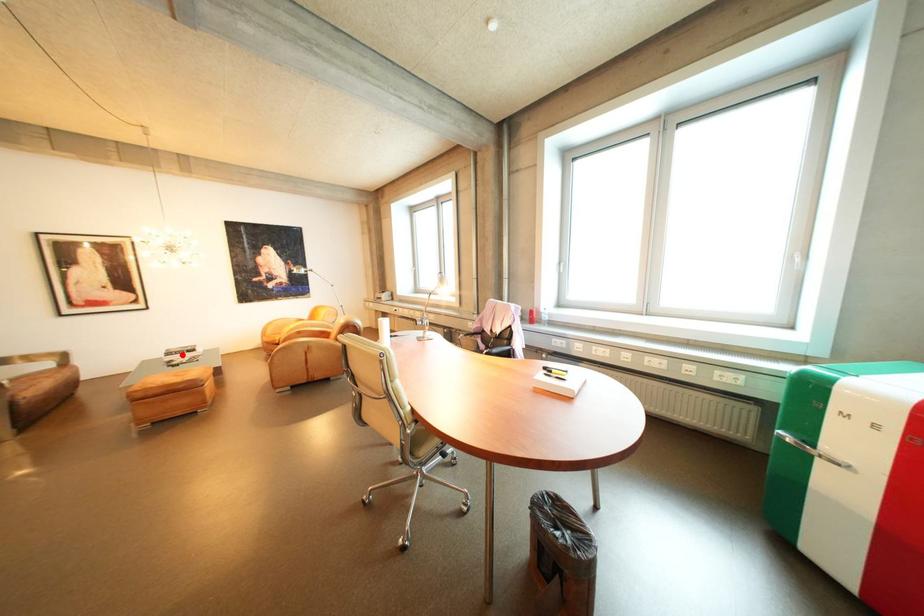
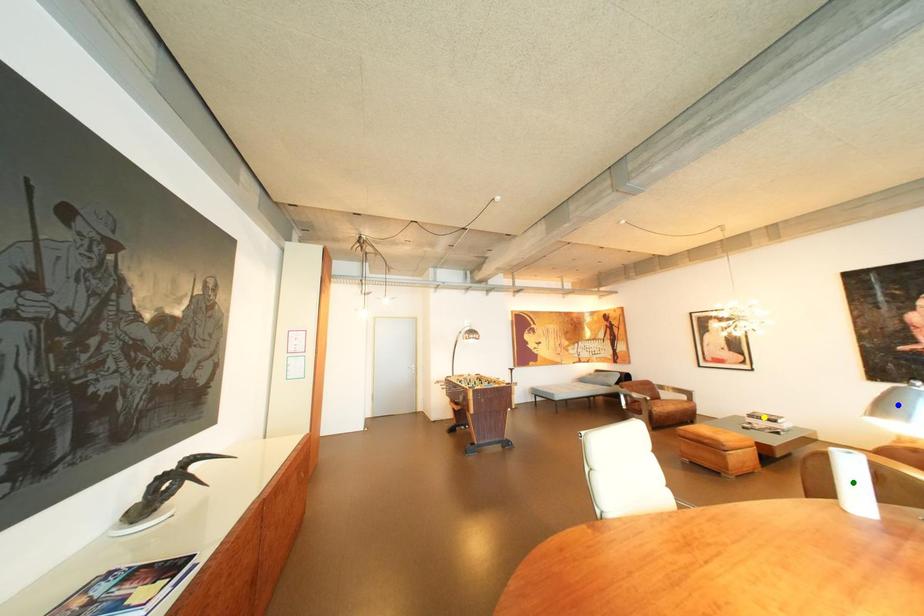
Question: I am providing you with two images of the same scene from different viewpoints. A red point is marked on the first image. You are given multiple points on the second image. Which spot in image 2 lines up with the point in image 1?

Choices:
 (A) yellow point
 (B) blue point
 (C) green point

Answer: (A)